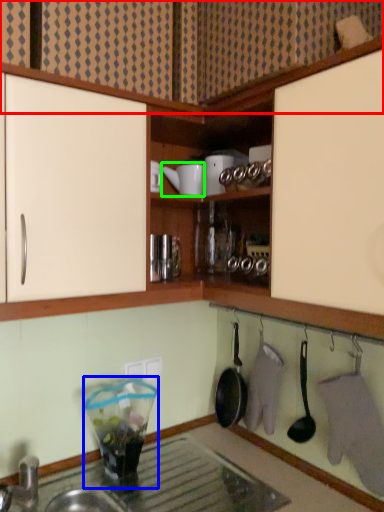
Question: Considering the real-world distances, which object is closest to cabinetry (highlighted by a red box)? appliance (highlighted by a blue box) or appliance (highlighted by a green box).

Choices:
 (A) appliance
 (B) appliance

Answer: (B)